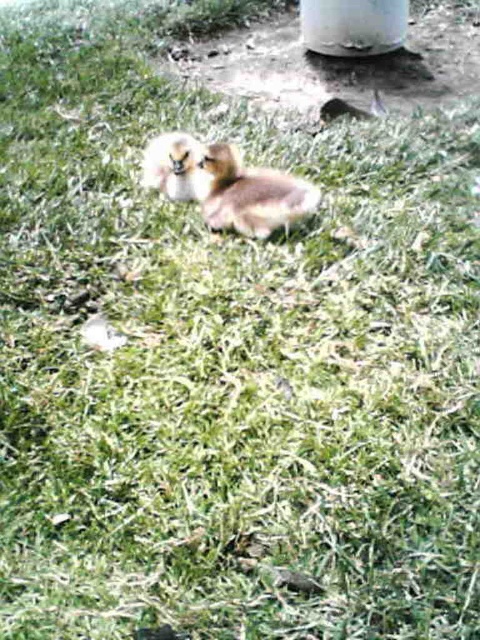
You are a photographer trying to capture a clear shot of the brown fuzzy duckling at center and the white glossy pillar at upper center. Based on their sizes in the image, which one would appear larger in your photo?

The brown fuzzy duckling at center appears much larger in the photo because it is much taller than the white glossy pillar at upper center.